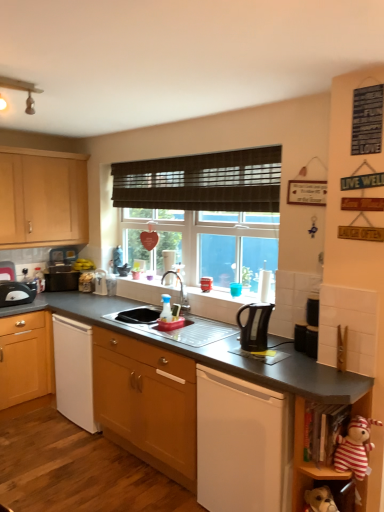
Question: From a real-world perspective, does striped fabric stuffed animal at lower right, which ranks as the 2th shelf in top-to-bottom order, stand above black plastic toaster at left, arranged as the first kitchen appliance when viewed from the left?

Choices:
 (A) yes
 (B) no

Answer: (B)

Question: Can we say striped fabric stuffed animal at lower right, which is the 1th shelf from bottom to top, lies outside black plastic toaster at left, which ranks as the second kitchen appliance in front-to-back order?

Choices:
 (A) yes
 (B) no

Answer: (A)

Question: From a real-world perspective, is striped fabric stuffed animal at lower right, which ranks as the 2th shelf in top-to-bottom order, under black plastic toaster at left, which ranks as the 2th kitchen appliance in right-to-left order?

Choices:
 (A) yes
 (B) no

Answer: (A)

Question: From the image's perspective, is striped fabric stuffed animal at lower right, which is the 1th shelf from bottom to top, on top of black plastic toaster at left, which ranks as the 2th kitchen appliance in right-to-left order?

Choices:
 (A) yes
 (B) no

Answer: (B)

Question: Is striped fabric stuffed animal at lower right, which is the 1th shelf from bottom to top, taller than black plastic toaster at left, the 1th kitchen appliance in the back-to-front sequence?

Choices:
 (A) yes
 (B) no

Answer: (A)

Question: In the image, is satin silver sink at center positioned in front of or behind wooden cabinet at center, which appears as the second cabinetry when viewed from the back?

Choices:
 (A) front
 (B) behind

Answer: (B)

Question: From a real-world perspective, is satin silver sink at center above or below wooden cabinet at center, placed as the first cabinetry when sorted from front to back?

Choices:
 (A) above
 (B) below

Answer: (A)

Question: From their relative heights in the image, would you say satin silver sink at center is taller or shorter than wooden cabinet at center, the first cabinetry positioned from the right?

Choices:
 (A) short
 (B) tall

Answer: (A)

Question: Considering the positions of satin silver sink at center and wooden cabinet at center, the second cabinetry viewed from the top, in the image, is satin silver sink at center wider or thinner than wooden cabinet at center, the second cabinetry viewed from the top,?

Choices:
 (A) wide
 (B) thin

Answer: (B)

Question: Do you think black plastic toaster at left, which ranks as the second kitchen appliance in front-to-back order, is within striped fabric stuffed animal at lower right, or outside of it?

Choices:
 (A) outside
 (B) inside

Answer: (A)

Question: From the image's perspective, is black plastic toaster at left, which ranks as the 2th kitchen appliance in right-to-left order, located above or below striped fabric stuffed animal at lower right?

Choices:
 (A) below
 (B) above

Answer: (B)

Question: Is black plastic toaster at left, arranged as the first kitchen appliance when viewed from the left, wider or thinner than striped fabric stuffed animal at lower right?

Choices:
 (A) thin
 (B) wide

Answer: (A)

Question: In terms of size, does black plastic toaster at left, the 1th kitchen appliance in the back-to-front sequence, appear bigger or smaller than striped fabric stuffed animal at lower right?

Choices:
 (A) big
 (B) small

Answer: (A)

Question: From a real-world perspective, is striped fabric stuffed animal at lower right above or below wooden cabinet at left, acting as the 1th cabinetry starting from the top?

Choices:
 (A) below
 (B) above

Answer: (A)

Question: Is striped fabric stuffed animal at lower right inside or outside of wooden cabinet at left, which is the 1th cabinetry in left-to-right order?

Choices:
 (A) outside
 (B) inside

Answer: (A)